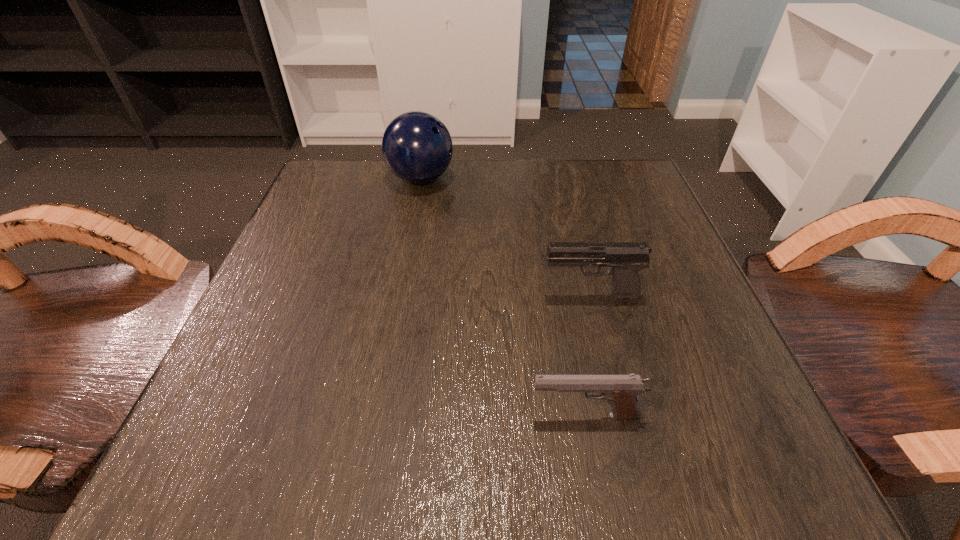
This screenshot has width=960, height=540. What are the coordinates of `free spot at the left edge of the desktop` in the screenshot? It's located at (364, 237).

Locate an element on the screen. The height and width of the screenshot is (540, 960). vacant space at the right edge is located at coordinates tap(708, 329).

Locate an element on the screen. This screenshot has height=540, width=960. blank space at the far left corner is located at coordinates (324, 197).

In the image, there is a desktop. Where is `vacant space at the far right corner`? Image resolution: width=960 pixels, height=540 pixels. vacant space at the far right corner is located at coordinates (620, 161).

The width and height of the screenshot is (960, 540). In order to click on free space at the near right corner in this screenshot , I will do `click(675, 475)`.

What are the coordinates of `vacant region between the nearest object and the second nearest object` in the screenshot? It's located at (588, 356).

Find the location of a particular element. vacant space in between the second shortest object and the shortest object is located at coordinates (588, 356).

The height and width of the screenshot is (540, 960). In order to click on empty location between the leftmost object and the second tallest object in this screenshot , I will do `click(505, 238)`.

Identify the location of empty location between the nearer pistol and the second nearest object. (588, 356).

Locate an element on the screen. The height and width of the screenshot is (540, 960). empty space that is in between the second farthest object and the nearer pistol is located at coordinates (588, 356).